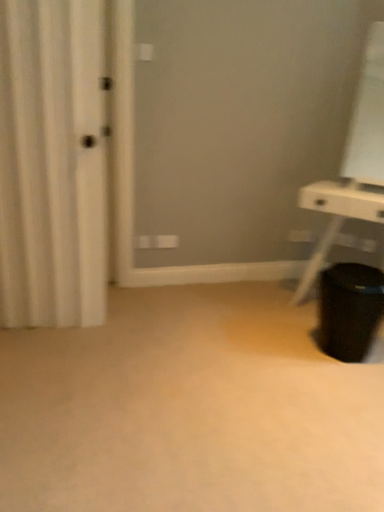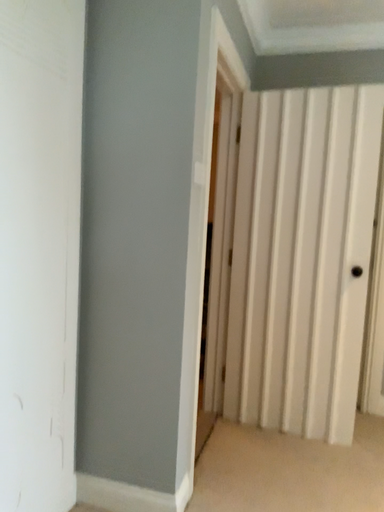
Question: Which way did the camera rotate in the video?

Choices:
 (A) rotated upward
 (B) rotated downward

Answer: (A)